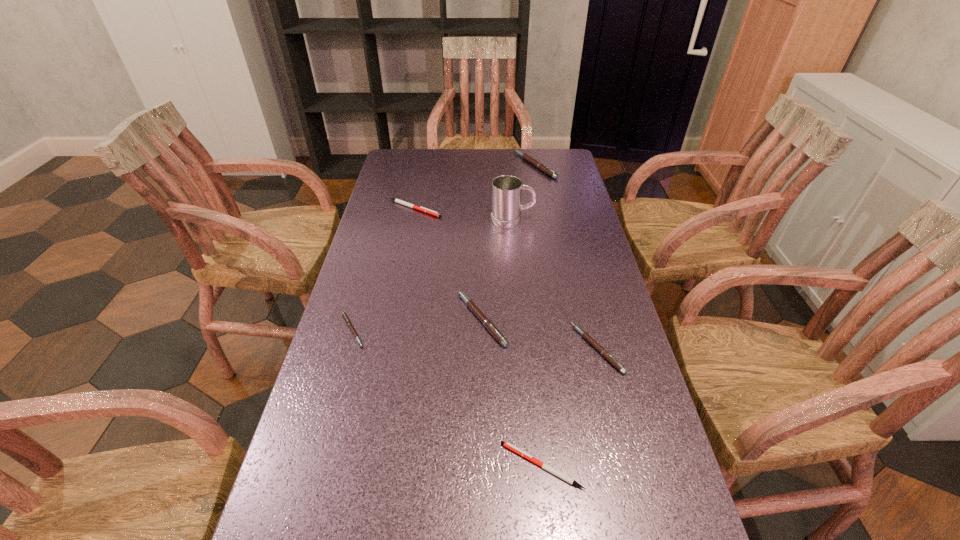
Locate an element on the screen. Image resolution: width=960 pixels, height=540 pixels. free space between the bigger white pen and the fifth shortest pen is located at coordinates (448, 264).

You are a GUI agent. You are given a task and a screenshot of the screen. Output one action in this format:
    pyautogui.click(x=<x>, y=<y>)
    Task: Click on the empty location between the third biggest pink pen and the gray mug
    This screenshot has width=960, height=540.
    Given the screenshot: What is the action you would take?
    pyautogui.click(x=555, y=284)

Image resolution: width=960 pixels, height=540 pixels. What are the coordinates of `object that is the sixth closest one to the farthest object` in the screenshot? It's located at (550, 469).

Locate an element on the screen. This screenshot has height=540, width=960. the closest object to the farthest object is located at coordinates (506, 190).

In order to click on pen that is the second closest to the tallest pen in this screenshot , I will do `click(487, 323)`.

You are a GUI agent. You are given a task and a screenshot of the screen. Output one action in this format:
    pyautogui.click(x=<x>, y=<y>)
    Task: Click on the fifth closest pen to the third tallest object
    The image size is (960, 540).
    Given the screenshot: What is the action you would take?
    [542, 167]

The image size is (960, 540). In order to click on pink pen that stands as the third closest to the smallest pink pen in this screenshot , I will do `click(542, 167)`.

Where is `pink pen that stands as the second closest to the second tallest pen`? The height and width of the screenshot is (540, 960). pink pen that stands as the second closest to the second tallest pen is located at coordinates (347, 320).

Identify which white pen is located as the second nearest to the leftmost pink pen. Please provide its 2D coordinates. Your answer should be formatted as a tuple, i.e. [(x, y)], where the tuple contains the x and y coordinates of a point satisfying the conditions above.

[(422, 209)]